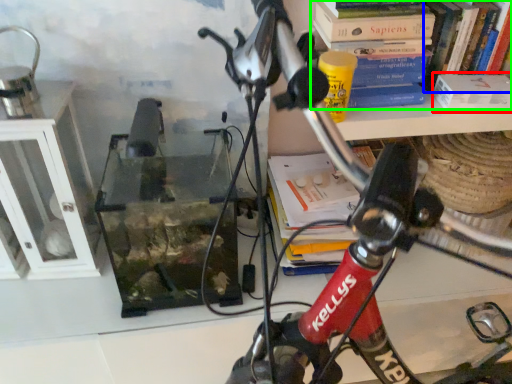
Question: Estimate the real-world distances between objects in this image. Which object is closer to paperback book (highlighted by a red box), book (highlighted by a blue box) or book (highlighted by a green box)?

Choices:
 (A) book
 (B) book

Answer: (A)